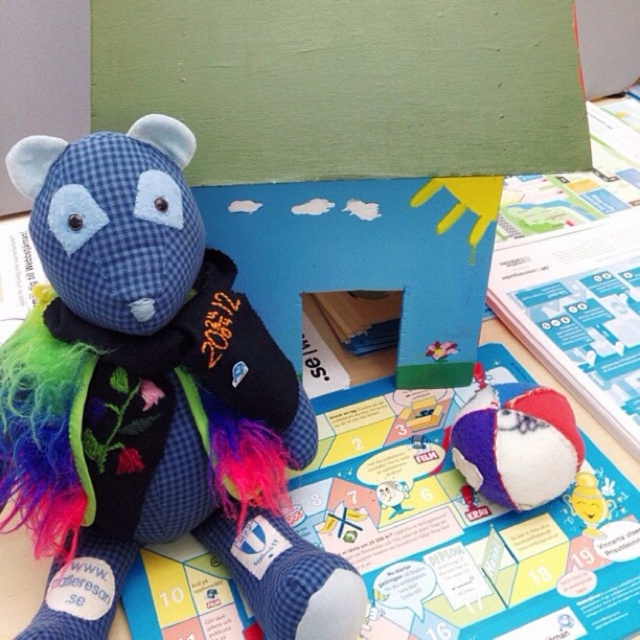
You are organizing a toy store shelf and need to place the blue checkered fabric teddy bear at center and the textured fabric ball at lower right. Since the shelf has limited space, which toy should you place first to ensure both fit?

The blue checkered fabric teddy bear at center is larger in width than the textured fabric ball at lower right, so you should place the blue checkered fabric teddy bear at center first to ensure both fit on the shelf.

You are a child trying to reach the textured fabric ball at lower right, but there is a blue checkered fabric teddy bear at center in the way. Can you move the teddy bear to get the ball?

The blue checkered fabric teddy bear at center is positioned over the textured fabric ball at lower right, so you can move the teddy bear to access the ball.

You are a child trying to grab the blue checkered fabric teddy bear at center and the textured fabric ball at lower right from the board game. Which toy is easier to reach?

The blue checkered fabric teddy bear at center is closer to the viewer than the textured fabric ball at lower right, so it is easier to reach.